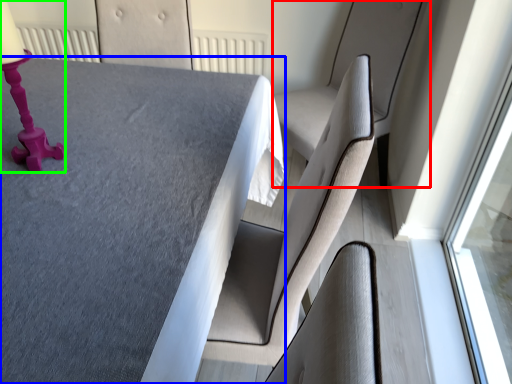
Question: Which object is the closest to the swivel chair (highlighted by a red box)? Choose among these: table (highlighted by a blue box) or table lamp (highlighted by a green box).

Choices:
 (A) table
 (B) table lamp

Answer: (A)